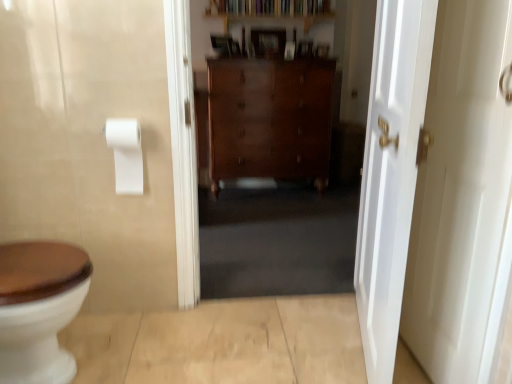
Question: Is white matte toilet paper at upper left facing towards white glossy door at right, positioned as the 2th door in right-to-left order?

Choices:
 (A) no
 (B) yes

Answer: (A)

Question: From the image's perspective, is white matte toilet paper at upper left under white glossy door at right, positioned as the 2th door in right-to-left order?

Choices:
 (A) yes
 (B) no

Answer: (B)

Question: Considering the relative sizes of white matte toilet paper at upper left and white glossy door at right, arranged as the first door when viewed from the left, in the image provided, is white matte toilet paper at upper left taller than white glossy door at right, arranged as the first door when viewed from the left,?

Choices:
 (A) no
 (B) yes

Answer: (A)

Question: Is white matte toilet paper at upper left bigger than white glossy door at right, positioned as the 2th door in right-to-left order?

Choices:
 (A) no
 (B) yes

Answer: (A)

Question: Is white matte toilet paper at upper left surrounding white glossy door at right, positioned as the 2th door in right-to-left order?

Choices:
 (A) yes
 (B) no

Answer: (B)

Question: From the image's perspective, is polished wood dresser at center positioned above or below white glossy door at right, which appears as the 2th door when viewed from the left?

Choices:
 (A) above
 (B) below

Answer: (A)

Question: From a real-world perspective, is polished wood dresser at center positioned above or below white glossy door at right, acting as the first door starting from the right?

Choices:
 (A) below
 (B) above

Answer: (A)

Question: In terms of height, does polished wood dresser at center look taller or shorter compared to white glossy door at right, which appears as the 2th door when viewed from the left?

Choices:
 (A) short
 (B) tall

Answer: (A)

Question: Choose the correct answer: Is polished wood dresser at center inside white glossy door at right, acting as the first door starting from the right, or outside it?

Choices:
 (A) inside
 (B) outside

Answer: (B)

Question: In the image, is white glossy door at right, which appears as the 2th door when viewed from the left, on the left side or the right side of wooden bookshelf at upper center?

Choices:
 (A) right
 (B) left

Answer: (A)

Question: Relative to wooden bookshelf at upper center, is white glossy door at right, acting as the first door starting from the right, in front or behind?

Choices:
 (A) front
 (B) behind

Answer: (A)

Question: From the image's perspective, is white glossy door at right, which appears as the 2th door when viewed from the left, located above or below wooden bookshelf at upper center?

Choices:
 (A) below
 (B) above

Answer: (A)

Question: Choose the correct answer: Is white glossy door at right, acting as the first door starting from the right, inside wooden bookshelf at upper center or outside it?

Choices:
 (A) inside
 (B) outside

Answer: (B)

Question: Is white glossy door at right, which appears as the 2th door when viewed from the left, bigger or smaller than white glossy door at right, positioned as the 2th door in right-to-left order?

Choices:
 (A) big
 (B) small

Answer: (B)

Question: Choose the correct answer: Is white glossy door at right, acting as the first door starting from the right, inside white glossy door at right, positioned as the 2th door in right-to-left order, or outside it?

Choices:
 (A) inside
 (B) outside

Answer: (B)